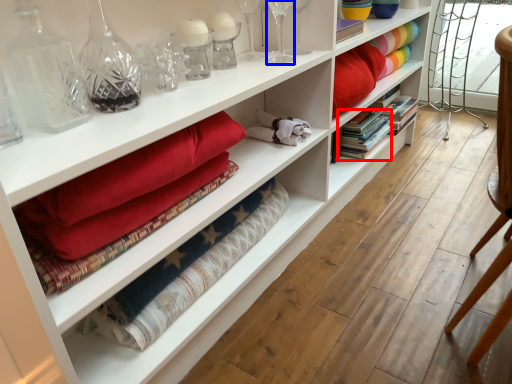
Question: Which object appears farthest to the camera in this image, book (highlighted by a red box) or glass vase (highlighted by a blue box)?

Choices:
 (A) book
 (B) glass vase

Answer: (A)